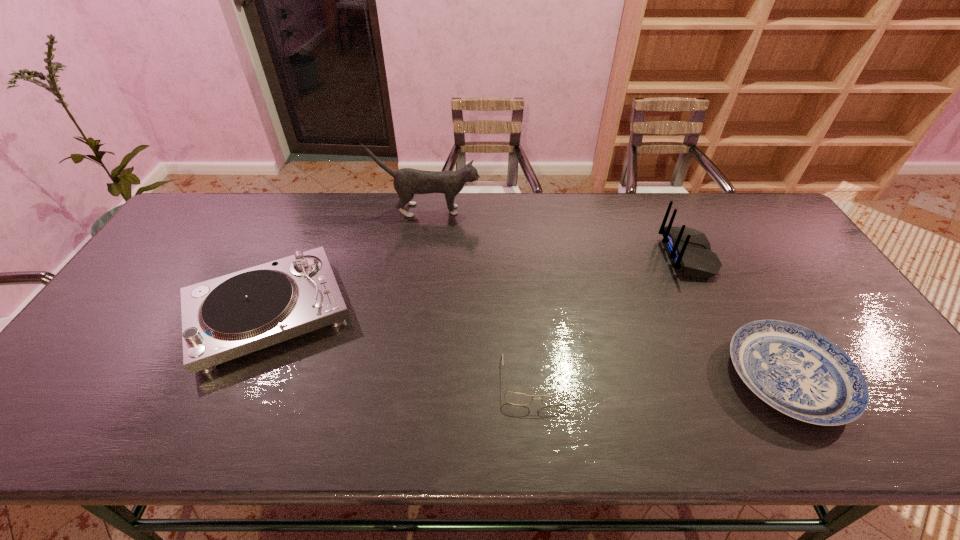
Identify the location of empty location between the spectacles and the second tallest object. The image size is (960, 540). (611, 318).

Where is `empty space between the fourth shortest object and the plate`? The image size is (960, 540). empty space between the fourth shortest object and the plate is located at coordinates (738, 316).

Where is `object that stands as the fourth closest to the farthest object`? object that stands as the fourth closest to the farthest object is located at coordinates click(x=797, y=371).

Identify which object is the nearest to the plate. Please provide its 2D coordinates. Your answer should be formatted as a tuple, i.e. [(x, y)], where the tuple contains the x and y coordinates of a point satisfying the conditions above.

[(689, 249)]

Locate an element on the screen. free point that satisfies the following two spatial constraints: 1. on the front side of the third tallest object; 2. on the right side of the plate is located at coordinates (241, 377).

The height and width of the screenshot is (540, 960). In order to click on free location that satisfies the following two spatial constraints: 1. at the face of the plate; 2. on the left side of the cat in this screenshot , I will do `click(403, 377)`.

Identify the location of free space in the image that satisfies the following two spatial constraints: 1. on the back of the plate; 2. on the left side of the router. (748, 377).

Where is `free point that satisfies the following two spatial constraints: 1. on the back of the router; 2. on the front-facing side of the spectacles`? The image size is (960, 540). free point that satisfies the following two spatial constraints: 1. on the back of the router; 2. on the front-facing side of the spectacles is located at coordinates (749, 380).

Where is `vacant space that satisfies the following two spatial constraints: 1. on the back of the fourth shortest object; 2. on the left side of the plate`? This screenshot has width=960, height=540. vacant space that satisfies the following two spatial constraints: 1. on the back of the fourth shortest object; 2. on the left side of the plate is located at coordinates (748, 377).